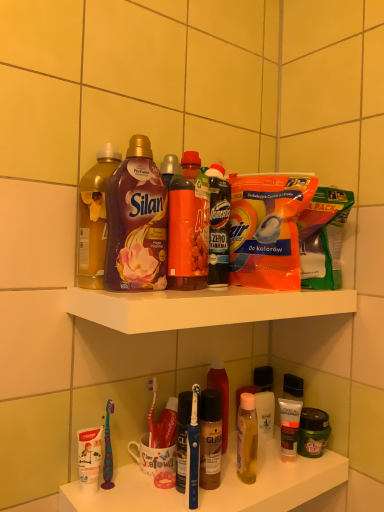
Question: Should I look upward or downward to see purple glossy liquid at upper center, which is the second bottle from left to right?

Choices:
 (A) down
 (B) up

Answer: (B)

Question: From the image's perspective, is white glossy bottle at lower center, the first toiletry positioned from the back, located above blue plastic toothbrush at lower center?

Choices:
 (A) yes
 (B) no

Answer: (B)

Question: Is the surface of white glossy bottle at lower center, marked as the 3th toiletry in a front-to-back arrangement, in direct contact with blue plastic toothbrush at lower center?

Choices:
 (A) no
 (B) yes

Answer: (A)

Question: Is white glossy bottle at lower center, the first toiletry positioned from the back, positioned before blue plastic toothbrush at lower center?

Choices:
 (A) no
 (B) yes

Answer: (A)

Question: Does white glossy bottle at lower center, the first toiletry positioned from the back, have a larger size compared to blue plastic toothbrush at lower center?

Choices:
 (A) yes
 (B) no

Answer: (A)

Question: From a real-world perspective, is white glossy bottle at lower center, the first toiletry positioned from the back, positioned over blue plastic toothbrush at lower center based on gravity?

Choices:
 (A) no
 (B) yes

Answer: (A)

Question: Considering the relative positions of white glossy bottle at lower center, the first toiletry positioned from the back, and blue plastic toothbrush at lower center in the image provided, is white glossy bottle at lower center, the first toiletry positioned from the back, to the left of blue plastic toothbrush at lower center from the viewer's perspective?

Choices:
 (A) yes
 (B) no

Answer: (B)

Question: Can you confirm if translucent plastic bottle at center, the first bottle from the back, is smaller than white plastic shelf at upper center?

Choices:
 (A) no
 (B) yes

Answer: (B)

Question: Is translucent plastic bottle at center, which is the third bottle in left-to-right order, facing away from white plastic shelf at upper center?

Choices:
 (A) yes
 (B) no

Answer: (B)

Question: Is translucent plastic bottle at center, which is counted as the 3th bottle, starting from the front, in front of white plastic shelf at upper center?

Choices:
 (A) yes
 (B) no

Answer: (B)

Question: Is translucent plastic bottle at center, which is the third bottle in left-to-right order, thinner than white plastic shelf at upper center?

Choices:
 (A) yes
 (B) no

Answer: (A)

Question: Does translucent plastic bottle at center, which ranks as the first bottle in right-to-left order, appear on the left side of white plastic shelf at upper center?

Choices:
 (A) yes
 (B) no

Answer: (A)

Question: Considering the relative sizes of translucent plastic bottle at center, the first bottle from the back, and white plastic shelf at upper center in the image provided, is translucent plastic bottle at center, the first bottle from the back, wider than white plastic shelf at upper center?

Choices:
 (A) no
 (B) yes

Answer: (A)

Question: Is the surface of white glossy bottle at lower center, the first toiletry positioned from the back, in direct contact with matte black tube at lower right, which is the second toiletry from front to back?

Choices:
 (A) yes
 (B) no

Answer: (A)